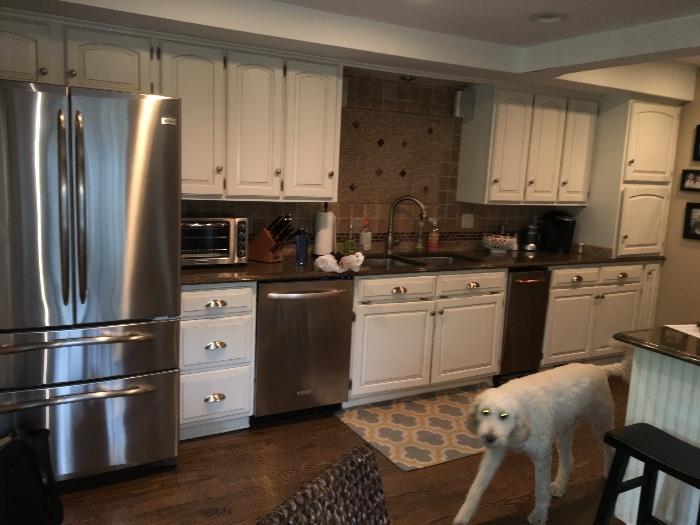
The image size is (700, 525). In order to click on dishwasher handle in this screenshot , I will do `click(302, 295)`.